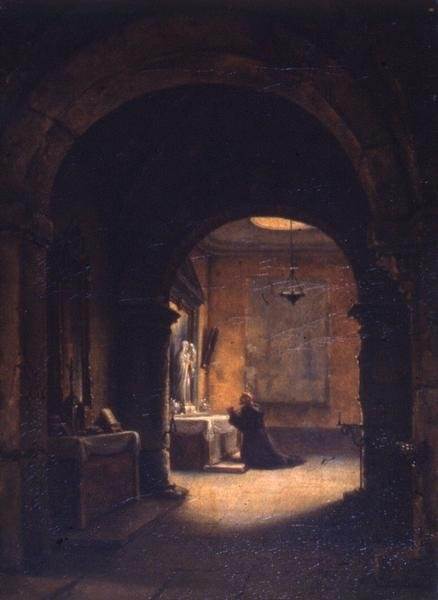
This screenshot has height=600, width=438. I want to click on altar, so click(197, 449).